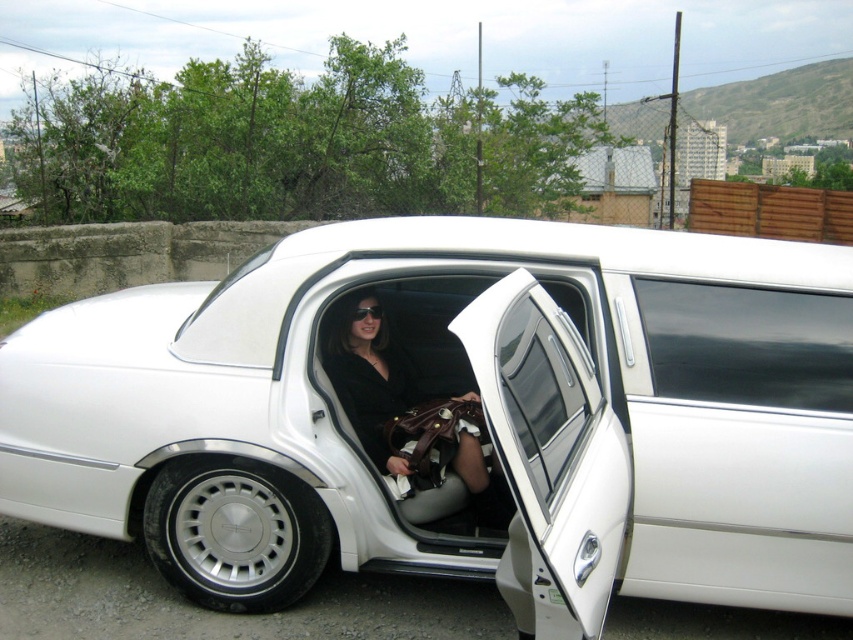
Question: Does white glossy limousine at center come behind black leather handbag at center?

Choices:
 (A) yes
 (B) no

Answer: (B)

Question: Which point is farther from the camera taking this photo?

Choices:
 (A) (445, 492)
 (B) (693, 412)
 (C) (492, 355)

Answer: (A)

Question: Which point is closer to the camera?

Choices:
 (A) black leather handbag at center
 (B) white glossy limousine at center
 (C) white glossy door at center

Answer: (C)

Question: Which object is the farthest from the white glossy door at center?

Choices:
 (A) white glossy limousine at center
 (B) black leather handbag at center

Answer: (B)

Question: Is the position of white glossy door at center less distant than that of black leather handbag at center?

Choices:
 (A) yes
 (B) no

Answer: (A)

Question: Where is white glossy door at center located in relation to black leather handbag at center in the image?

Choices:
 (A) right
 (B) left

Answer: (A)